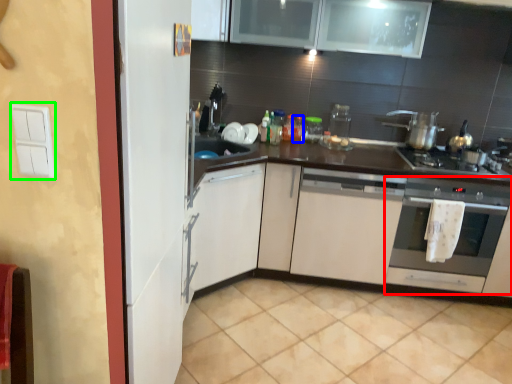
Question: Based on their relative distances, which object is farther from oven (highlighted by a red box)? Choose from bottle (highlighted by a blue box) and light switch (highlighted by a green box).

Choices:
 (A) bottle
 (B) light switch

Answer: (B)